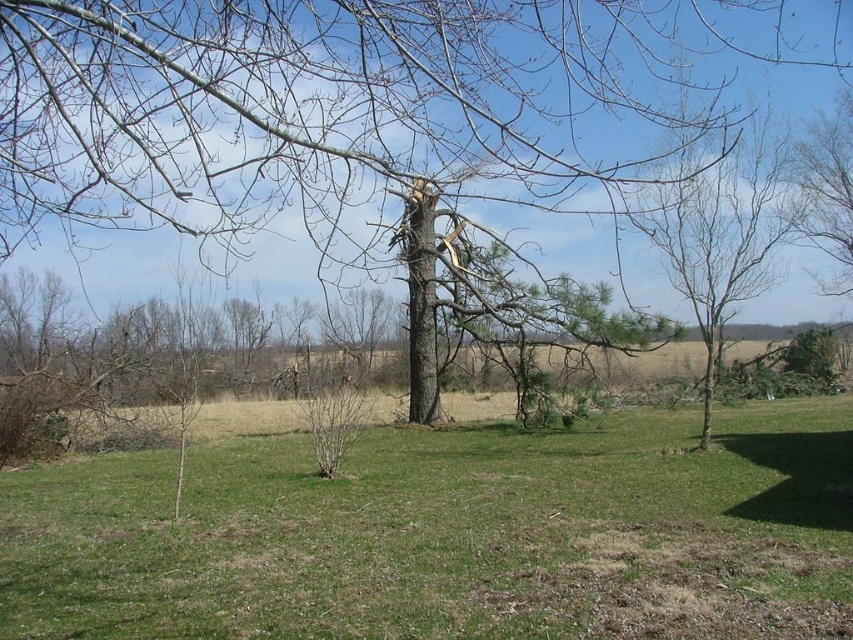
Question: Is the position of brown rough tree at center more distant than that of bare branches at right?

Choices:
 (A) yes
 (B) no

Answer: (B)

Question: Which point is farther to the camera?

Choices:
 (A) (711, 129)
 (B) (698, 186)

Answer: (B)

Question: Is green grass at center positioned before brown rough tree at center?

Choices:
 (A) no
 (B) yes

Answer: (A)

Question: Which object is positioned farthest from the green grass at center?

Choices:
 (A) brown rough tree at center
 (B) bare branches at right

Answer: (A)

Question: Among these points, which one is nearest to the camera?

Choices:
 (A) (766, 269)
 (B) (328, 16)
 (C) (674, 577)

Answer: (B)

Question: Observing the image, what is the correct spatial positioning of green grass at center in reference to brown rough tree at center?

Choices:
 (A) left
 (B) right

Answer: (A)